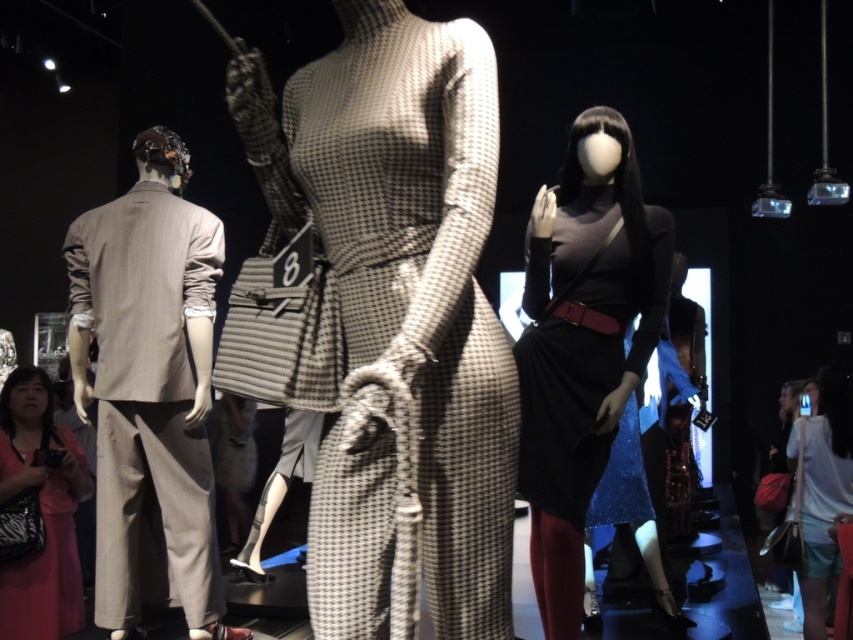
You are a photographer setting up a shoot in the fashion exhibit. You need to position your camera so that both the matte black dress at center and the pink fabric dress at lower left are in frame. Considering their sizes, which dress should you focus on to ensure both are visible without cropping?

The matte black dress at center occupies less space than the pink fabric dress at lower left, so focusing on the pink fabric dress at lower left will help ensure both are visible in the frame without cropping.

You are a visitor at the fashion exhibit and want to take a photo of both the matte black dress at center and the pink fabric dress at lower left. Since the lighting is dim, you need to ensure both dresses are visible in the frame. Based on their positions, will you be able to capture both in a single photo without moving your camera? Explain your reasoning.

The matte black dress at center is above the pink fabric dress at lower left, so if you position your camera to include both the upper and lower parts of the exhibit area, you can capture both dresses in a single photo without moving the camera.